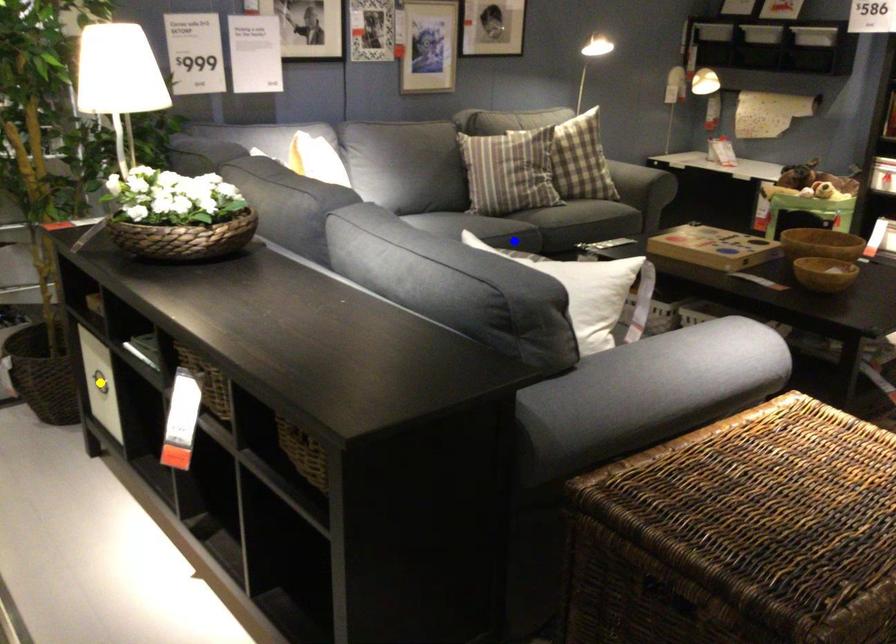
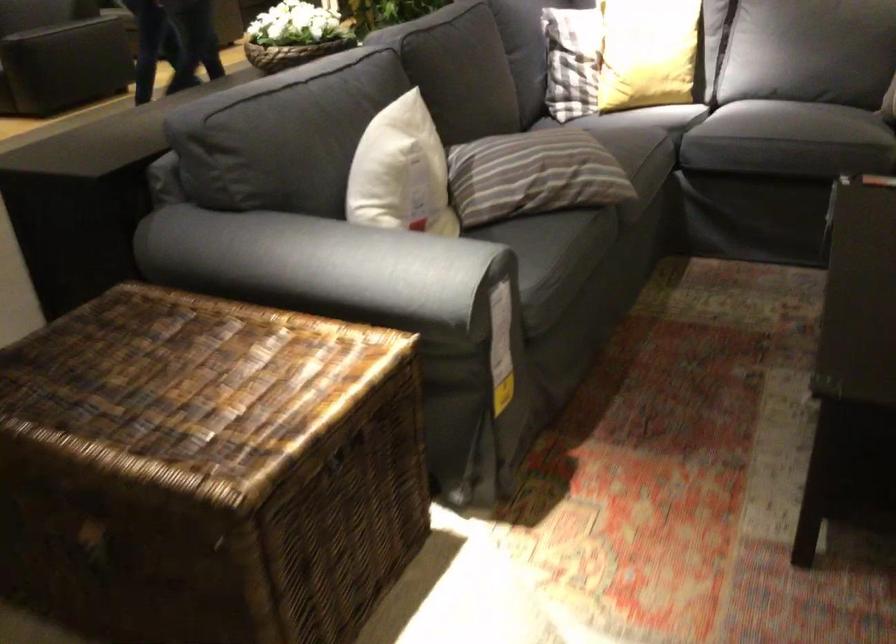
I am providing you with two images of the same scene from different viewpoints. Three points are marked in image1. Which point corresponds to a part or object that is occluded in image2?In image1, three points are marked. Which of them correspond to a part or object that is occluded in image2?Among the three points shown in image1, which one corresponds to a part or object that is no longer visible due to occlusion in image2?

Invisible in image2: green point, yellow point.